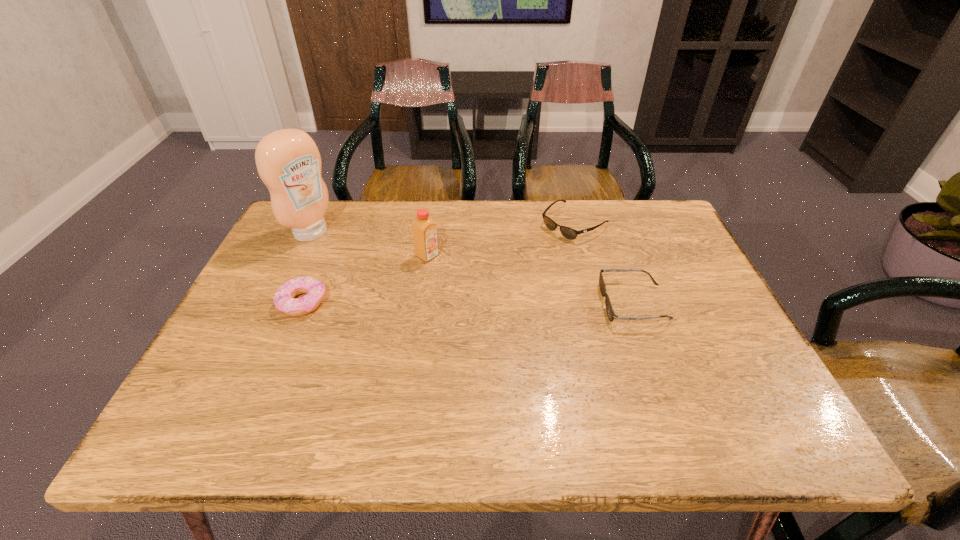
Locate an element on the screen. vacant space situated 0.150m on the front and back of the fourth shortest object is located at coordinates (478, 285).

Find the location of `vacant space located 0.200m on the front and back of the fourth shortest object`. vacant space located 0.200m on the front and back of the fourth shortest object is located at coordinates (493, 294).

I want to click on free region located 0.080m on the front and back of the fourth shortest object, so click(458, 273).

The image size is (960, 540). Identify the location of free space located on the front-facing side of the farther sunglasses. (487, 285).

What are the coordinates of `vacant space situated on the front-facing side of the farther sunglasses` in the screenshot? It's located at (459, 306).

Locate an element on the screen. vacant area situated 0.390m on the front-facing side of the farther sunglasses is located at coordinates (456, 308).

Where is `vacant space located 0.110m on the label of the condiment`? The height and width of the screenshot is (540, 960). vacant space located 0.110m on the label of the condiment is located at coordinates (350, 258).

You are a GUI agent. You are given a task and a screenshot of the screen. Output one action in this format:
    pyautogui.click(x=<x>, y=<y>)
    Task: Click on the vacant space positioned on the label of the condiment
    Image resolution: width=960 pixels, height=540 pixels.
    Given the screenshot: What is the action you would take?
    pyautogui.click(x=368, y=268)

This screenshot has height=540, width=960. Find the location of `vacant space located 0.140m on the label of the condiment`. vacant space located 0.140m on the label of the condiment is located at coordinates (358, 262).

Locate an element on the screen. The image size is (960, 540). sunglasses that is at the far edge is located at coordinates (569, 233).